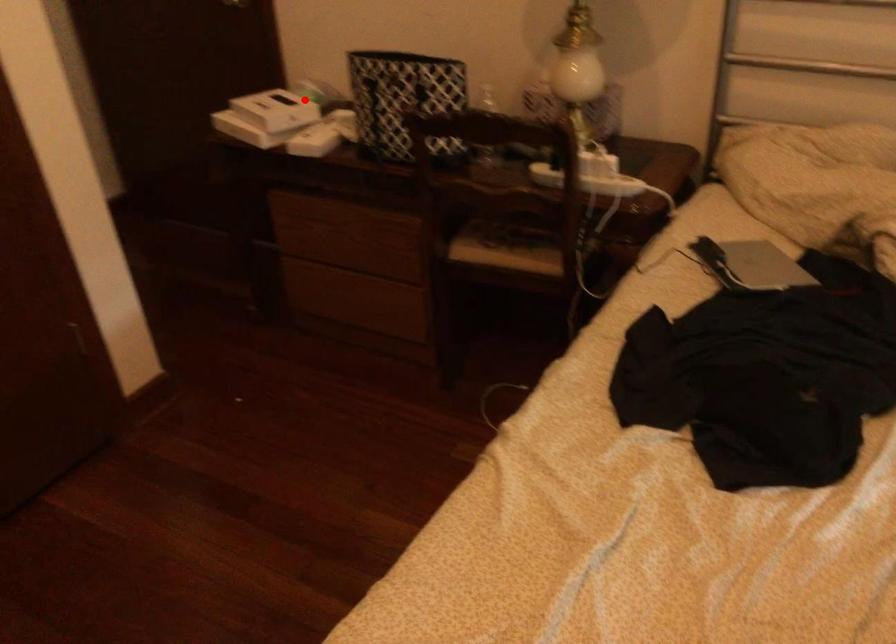
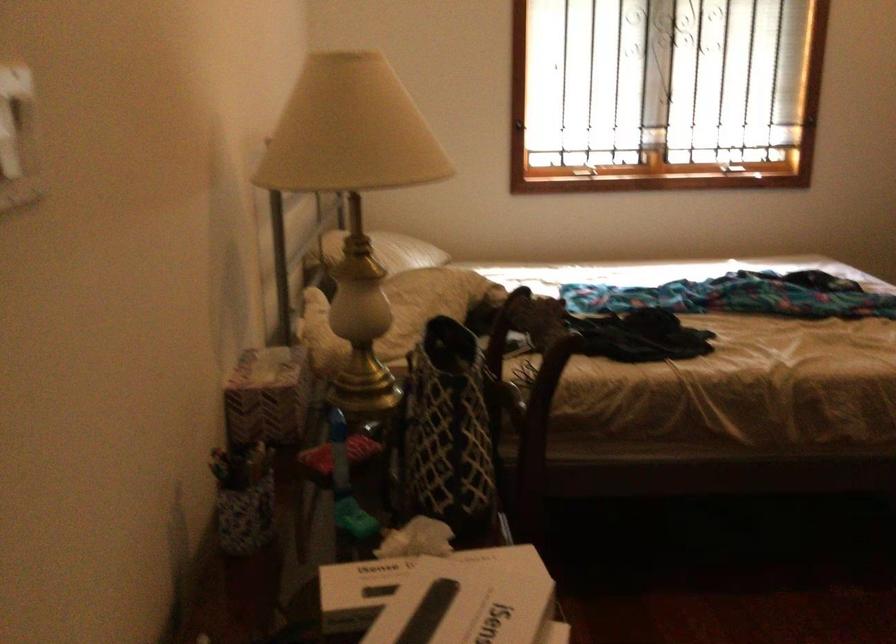
The point at the highlighted location is marked in the first image. Where is the corresponding point in the second image?

(407, 583)